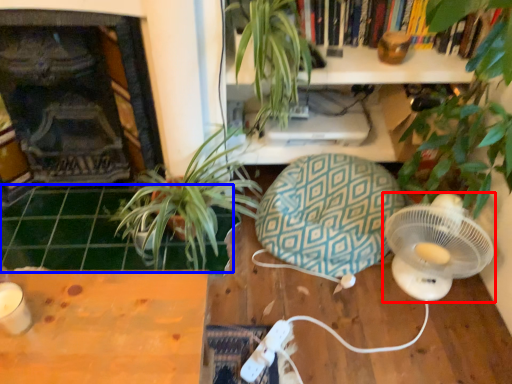
Question: Which object is further to the camera taking this photo, mechanical fan (highlighted by a red box) or tile (highlighted by a blue box)?

Choices:
 (A) mechanical fan
 (B) tile

Answer: (B)